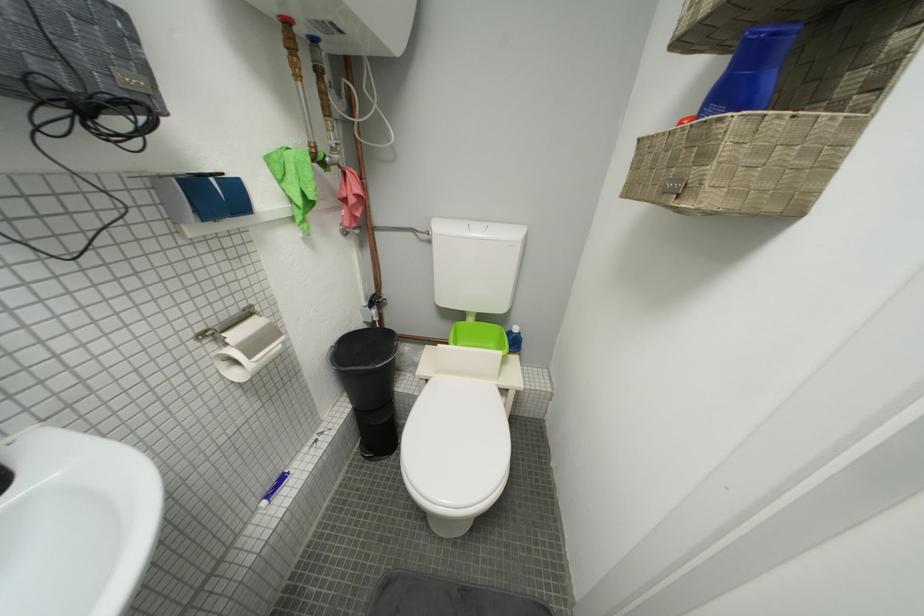
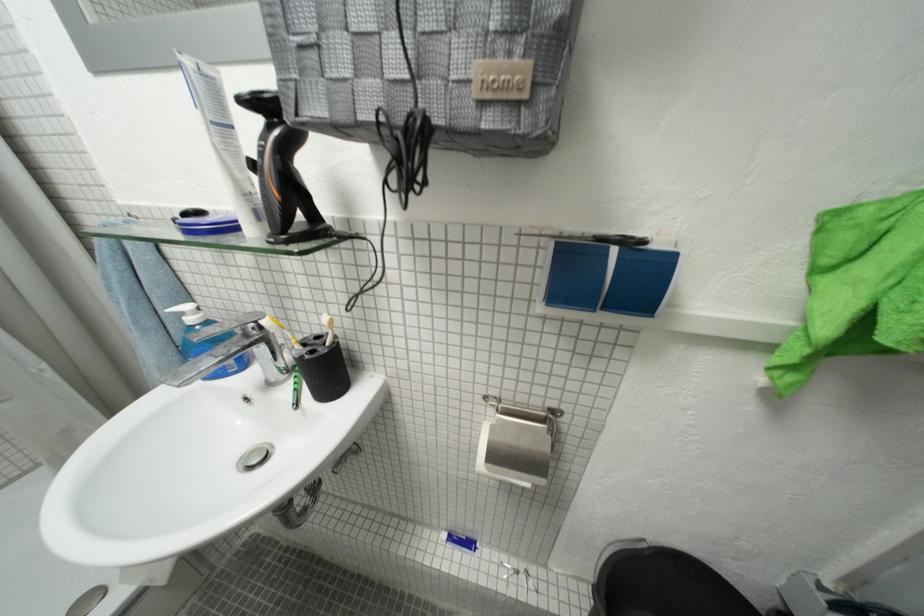
Locate, in the second image, the point that corresponds to the point at 273,505 in the first image.

(454, 538)